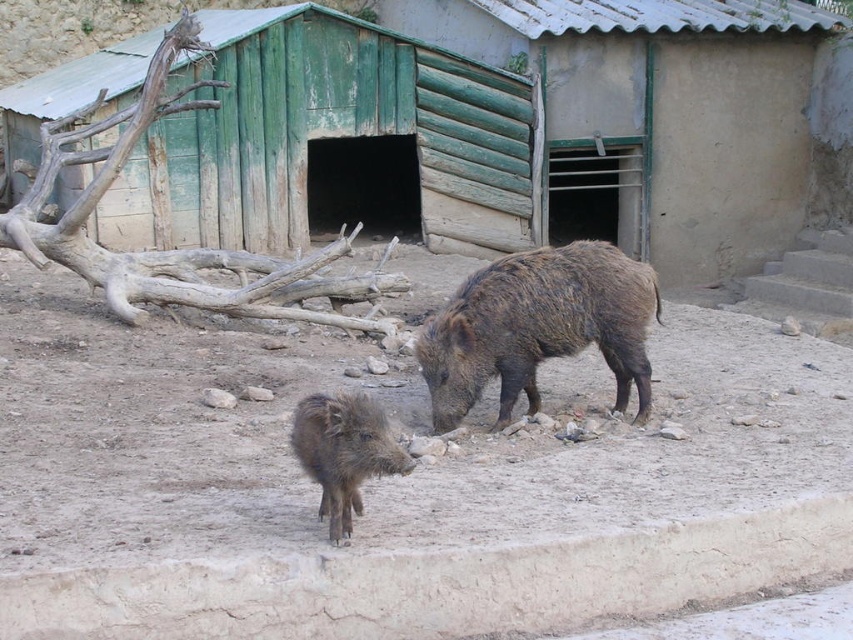
You are a zookeeper trying to clean the enclosure. You see the brown sandy dirt at center and the brown rough textured pig at center. Which object is closer to the ground?

The brown sandy dirt at center is located below the brown rough textured pig at center, so the brown sandy dirt at center is closer to the ground.

You are a zookeeper who needs to clean the enclosure. You see the brown sandy dirt at center and the brown rough textured pig at center. Which object is closer to you as you stand at the entrance?

The brown sandy dirt at center is closer to you because it is in front of the brown rough textured pig at center.